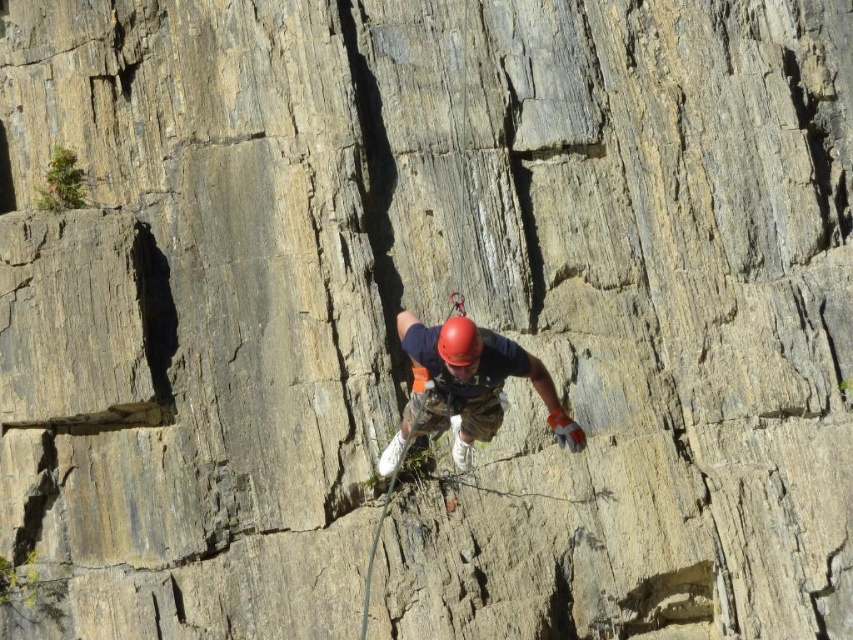
Question: Does matte blue shirt at center come in front of red matte helmet at center?

Choices:
 (A) yes
 (B) no

Answer: (B)

Question: Does matte blue shirt at center have a greater width compared to red matte helmet at center?

Choices:
 (A) yes
 (B) no

Answer: (A)

Question: Among these points, which one is farthest from the camera?

Choices:
 (A) (502, 372)
 (B) (468, 376)

Answer: (A)

Question: Among these points, which one is nearest to the camera?

Choices:
 (A) (477, 344)
 (B) (473, 385)

Answer: (A)

Question: Is matte blue shirt at center to the left of red matte helmet at center from the viewer's perspective?

Choices:
 (A) no
 (B) yes

Answer: (A)